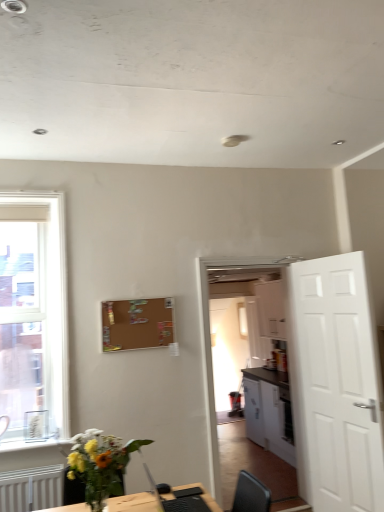
Question: Does clear glass window at left touch translucent glass vase at lower left?

Choices:
 (A) no
 (B) yes

Answer: (A)

Question: Can you confirm if clear glass window at left is wider than translucent glass vase at lower left?

Choices:
 (A) no
 (B) yes

Answer: (A)

Question: From a real-world perspective, is clear glass window at left positioned over translucent glass vase at lower left based on gravity?

Choices:
 (A) yes
 (B) no

Answer: (A)

Question: Is clear glass window at left far from translucent glass vase at lower left?

Choices:
 (A) no
 (B) yes

Answer: (B)

Question: Considering the relative positions of clear glass window at left and translucent glass vase at lower left in the image provided, is clear glass window at left in front of translucent glass vase at lower left?

Choices:
 (A) no
 (B) yes

Answer: (A)

Question: Can you confirm if clear glass window at left is smaller than translucent glass vase at lower left?

Choices:
 (A) yes
 (B) no

Answer: (B)

Question: Are brown matte bulletin board at upper center and white glossy cabinet at center far apart?

Choices:
 (A) no
 (B) yes

Answer: (B)

Question: Does brown matte bulletin board at upper center have a lesser width compared to white glossy cabinet at center?

Choices:
 (A) no
 (B) yes

Answer: (B)

Question: Does brown matte bulletin board at upper center have a greater height compared to white glossy cabinet at center?

Choices:
 (A) no
 (B) yes

Answer: (A)

Question: Is brown matte bulletin board at upper center at the left side of white glossy cabinet at center?

Choices:
 (A) no
 (B) yes

Answer: (B)

Question: From the image's perspective, would you say brown matte bulletin board at upper center is shown under white glossy cabinet at center?

Choices:
 (A) no
 (B) yes

Answer: (A)

Question: Does brown matte bulletin board at upper center have a greater width compared to white glossy cabinet at center?

Choices:
 (A) yes
 (B) no

Answer: (B)

Question: Is white glossy cabinet at center to the left of translucent glass vase at lower left from the viewer's perspective?

Choices:
 (A) yes
 (B) no

Answer: (B)